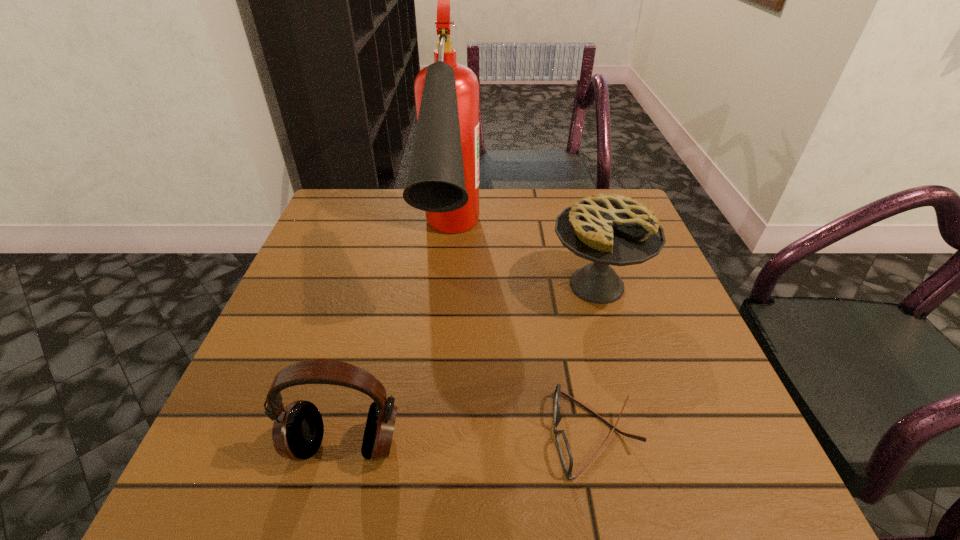
Locate an element on the screen. Image resolution: width=960 pixels, height=540 pixels. vacant area that lies between the spectacles and the tallest object is located at coordinates (522, 342).

I want to click on vacant region between the pie and the headset, so click(470, 365).

The image size is (960, 540). I want to click on free space between the headset and the shortest object, so tap(469, 439).

The height and width of the screenshot is (540, 960). What are the coordinates of `empty location between the pie and the shortest object` in the screenshot? It's located at (595, 359).

Where is `vacant area that lies between the pie and the shortest object`? This screenshot has height=540, width=960. vacant area that lies between the pie and the shortest object is located at coordinates (595, 359).

I want to click on empty space between the fire extinguisher and the headset, so click(397, 347).

At what (x,y) coordinates should I click in order to perform the action: click on vacant area between the headset and the spectacles. Please return your answer as a coordinate pair (x, y). Image resolution: width=960 pixels, height=540 pixels. Looking at the image, I should click on [x=469, y=439].

This screenshot has height=540, width=960. In order to click on free point between the headset and the fire extinguisher in this screenshot , I will do [x=397, y=347].

Find the location of a particular element. Image resolution: width=960 pixels, height=540 pixels. free space between the tallest object and the shortest object is located at coordinates coord(522,342).

Select which object is the third closest to the shortest object. Please provide its 2D coordinates. Your answer should be formatted as a tuple, i.e. [(x, y)], where the tuple contains the x and y coordinates of a point satisfying the conditions above.

[(297, 433)]